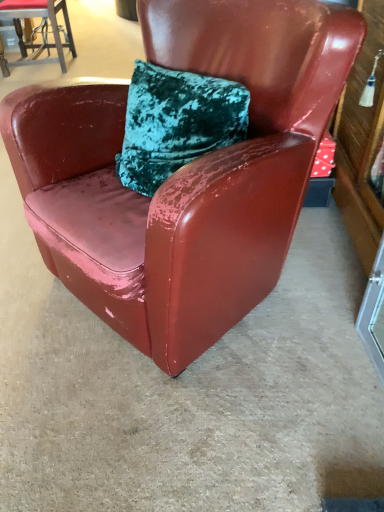
Question: Is glossy leather chair at upper left, which is the 1th chair from top to bottom, closer to the viewer compared to glossy leather chair at center, acting as the 1th chair starting from the front?

Choices:
 (A) yes
 (B) no

Answer: (B)

Question: Could you tell me if glossy leather chair at upper left, which is the 1th chair from top to bottom, is turned towards glossy leather chair at center, acting as the 2th chair starting from the back?

Choices:
 (A) yes
 (B) no

Answer: (B)

Question: Can you confirm if glossy leather chair at upper left, the first chair in the left-to-right sequence, is smaller than glossy leather chair at center, acting as the 2th chair starting from the back?

Choices:
 (A) yes
 (B) no

Answer: (A)

Question: Is glossy leather chair at upper left, the first chair in the back-to-front sequence, outside glossy leather chair at center, arranged as the 2th chair when viewed from the left?

Choices:
 (A) no
 (B) yes

Answer: (B)

Question: Considering the relative positions of glossy leather chair at upper left, marked as the 2th chair in a right-to-left arrangement, and glossy leather chair at center, acting as the 1th chair starting from the front, in the image provided, is glossy leather chair at upper left, marked as the 2th chair in a right-to-left arrangement, to the right of glossy leather chair at center, acting as the 1th chair starting from the front, from the viewer's perspective?

Choices:
 (A) no
 (B) yes

Answer: (A)

Question: Is glossy leather chair at upper left, the 2th chair when ordered from front to back, facing away from glossy leather chair at center, acting as the 1th chair starting from the front?

Choices:
 (A) no
 (B) yes

Answer: (A)

Question: From the image's perspective, does glossy leather chair at center, the 2th chair when ordered from top to bottom, appear lower than transparent glass door at lower right?

Choices:
 (A) no
 (B) yes

Answer: (A)

Question: Is glossy leather chair at center, the 2th chair when ordered from top to bottom, smaller than transparent glass door at lower right?

Choices:
 (A) yes
 (B) no

Answer: (B)

Question: Is glossy leather chair at center, acting as the 1th chair starting from the front, at the right side of transparent glass door at lower right?

Choices:
 (A) no
 (B) yes

Answer: (A)

Question: From a real-world perspective, is glossy leather chair at center, the 1th chair when ordered from bottom to top, under transparent glass door at lower right?

Choices:
 (A) no
 (B) yes

Answer: (A)

Question: Is glossy leather chair at center, acting as the 1th chair starting from the front, far from transparent glass door at lower right?

Choices:
 (A) yes
 (B) no

Answer: (B)

Question: Is glossy leather chair at center, acting as the 2th chair starting from the back, directly adjacent to transparent glass door at lower right?

Choices:
 (A) no
 (B) yes

Answer: (A)

Question: Is the position of transparent glass door at lower right more distant than that of glossy leather chair at upper left, the first chair in the left-to-right sequence?

Choices:
 (A) no
 (B) yes

Answer: (A)